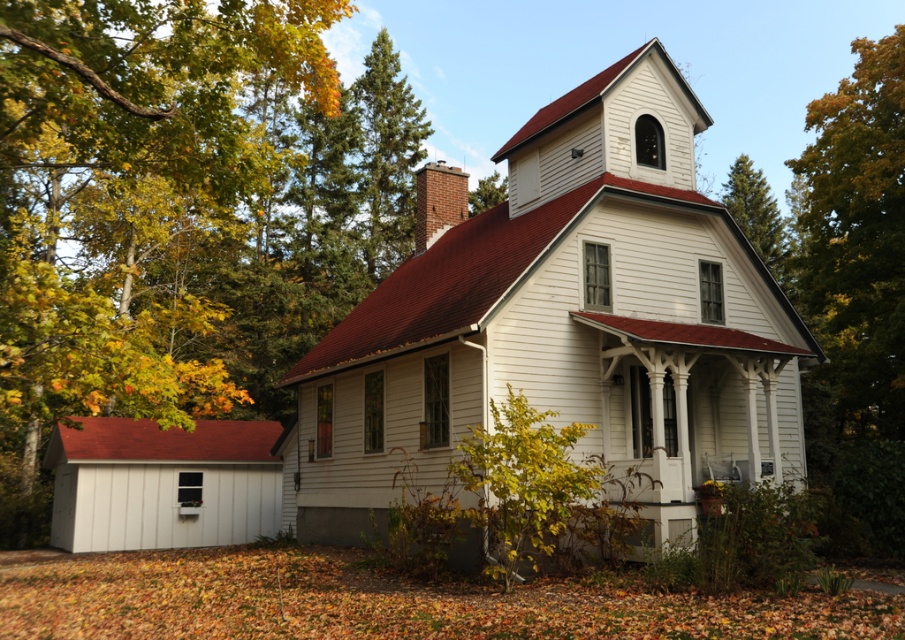
You are standing at a distance from the house and want to take a photo of the point marked at coordinates point (126, 266). If your camera has a maximum focus range of 100 feet, will you be able to focus on that point?

The distance of point (126, 266) from viewer is 120.66 feet, which exceeds the camera maximum focus range of 100 feet. Therefore, you won not be able to focus on that point.

You are standing in front of the house and see two points marked on the image. The first point is at coordinates point (186, 132) and the second is at point (621, 250). Which point is closer to you?

Point (186, 132) is in front of point (621, 250), so it is closer to you.